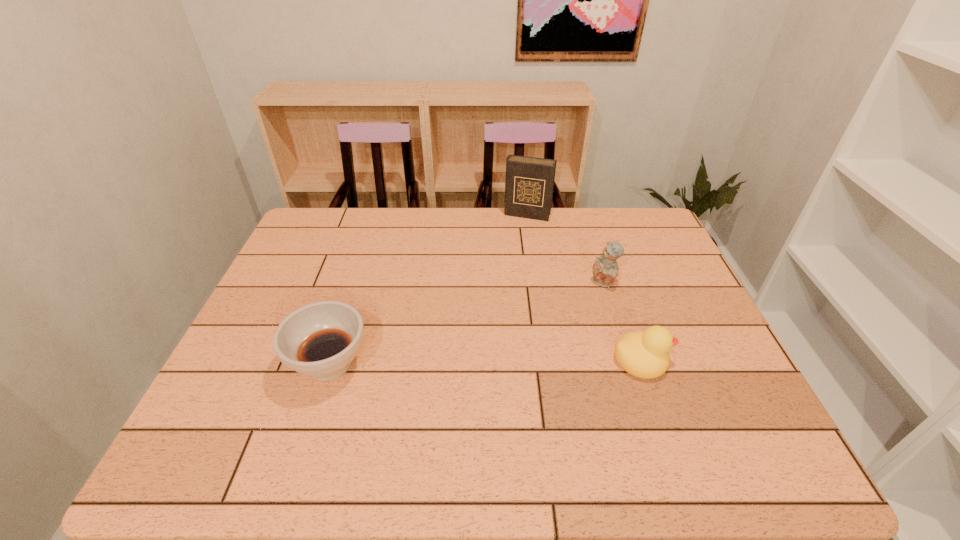
Where is `free space that satisfies the following two spatial constraints: 1. on the back side of the farthest object; 2. on the right side of the leftmost object`? The image size is (960, 540). free space that satisfies the following two spatial constraints: 1. on the back side of the farthest object; 2. on the right side of the leftmost object is located at coordinates (377, 215).